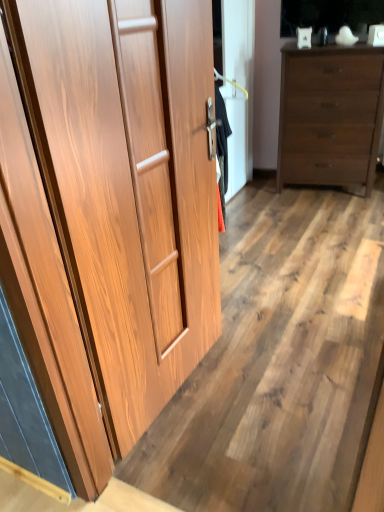
Locate an element on the screen. vacant space to the right of wooden cupboard at left is located at coordinates (271, 376).